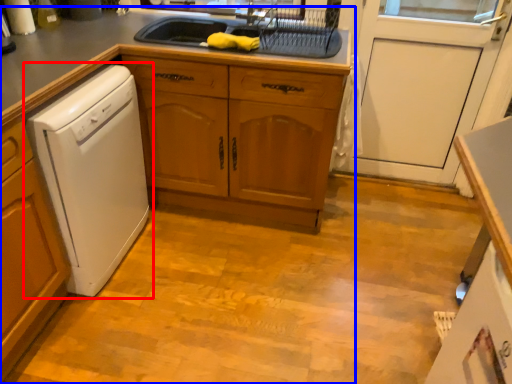
Question: Which object appears closest to the camera in this image, home appliance (highlighted by a red box) or countertop (highlighted by a blue box)?

Choices:
 (A) home appliance
 (B) countertop

Answer: (A)